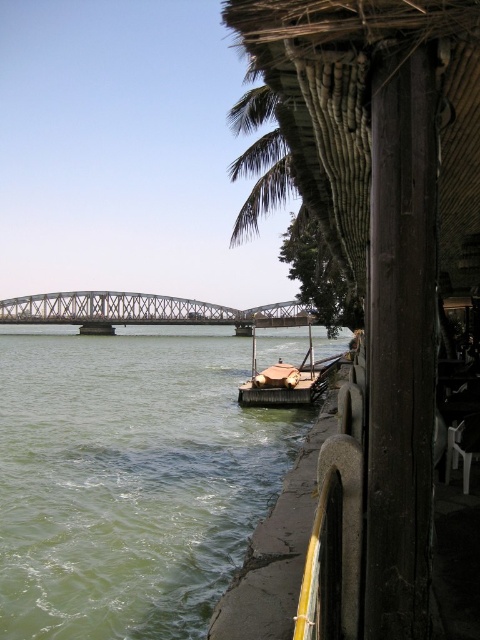
Can you confirm if green water at center is wider than wooden boat at center?

Correct, the width of green water at center exceeds that of wooden boat at center.

Which is in front, point (64, 426) or point (311, 385)?

Positioned in front is point (64, 426).

Where is `green water at center`? Image resolution: width=480 pixels, height=640 pixels. green water at center is located at coordinates (129, 477).

Does gray metallic bridge at center come in front of wooden boat at center?

That is False.

Does point (256, 324) come behind point (279, 392)?

Yes, it is.

At what (x,y) coordinates should I click in order to perform the action: click on gray metallic bridge at center. Please return your answer as a coordinate pair (x, y). Looking at the image, I should click on (143, 310).

Is thatched straw hut at right closer to camera compared to gray metallic bridge at center?

Yes, thatched straw hut at right is in front of gray metallic bridge at center.

Does thatched straw hut at right have a smaller size compared to gray metallic bridge at center?

Yes, thatched straw hut at right is smaller than gray metallic bridge at center.

What are the coordinates of `thatched straw hut at right` in the screenshot? It's located at (377, 268).